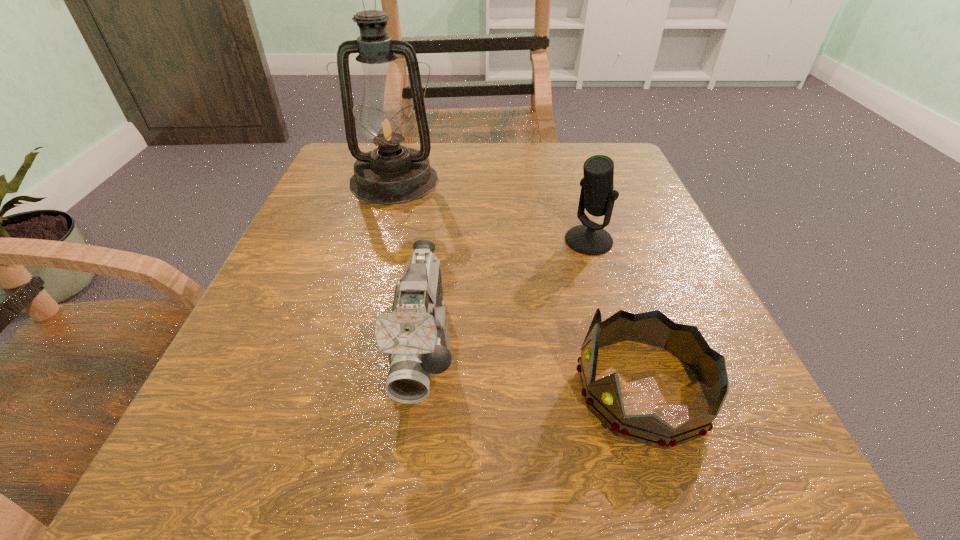
Where is `vacant space at the left edge of the desktop`? This screenshot has width=960, height=540. vacant space at the left edge of the desktop is located at coordinates (335, 230).

This screenshot has height=540, width=960. I want to click on vacant region at the right edge of the desktop, so click(685, 267).

Identify the location of vacant area at the near left corner. Image resolution: width=960 pixels, height=540 pixels. (251, 510).

Where is `vacant region at the far right corner of the desktop`? The height and width of the screenshot is (540, 960). vacant region at the far right corner of the desktop is located at coordinates (573, 189).

The image size is (960, 540). Find the location of `free space between the camcorder and the second farthest object`. free space between the camcorder and the second farthest object is located at coordinates (506, 292).

This screenshot has width=960, height=540. In order to click on vacant space that is in between the camcorder and the second farthest object in this screenshot , I will do `click(506, 292)`.

The height and width of the screenshot is (540, 960). In order to click on free space between the third nearest object and the camcorder in this screenshot , I will do `click(506, 292)`.

At what (x,y) coordinates should I click in order to perform the action: click on blank region between the oil lamp and the tiara. Please return your answer as a coordinate pair (x, y). The width and height of the screenshot is (960, 540). Looking at the image, I should click on (518, 285).

The image size is (960, 540). In order to click on free point between the tallest object and the tiara in this screenshot , I will do `click(518, 285)`.

Where is `unoccupied area between the camcorder and the microphone`? Image resolution: width=960 pixels, height=540 pixels. unoccupied area between the camcorder and the microphone is located at coordinates (506, 292).